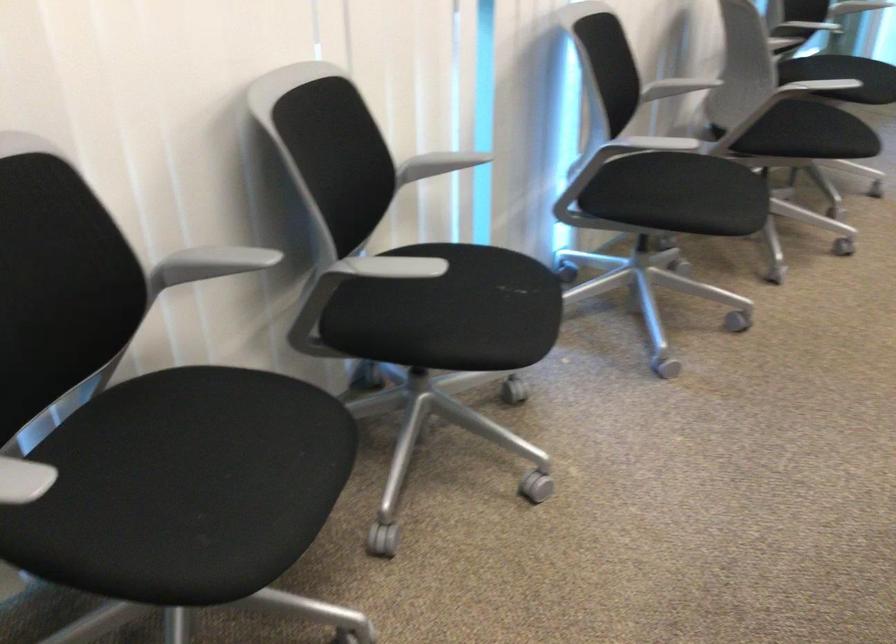
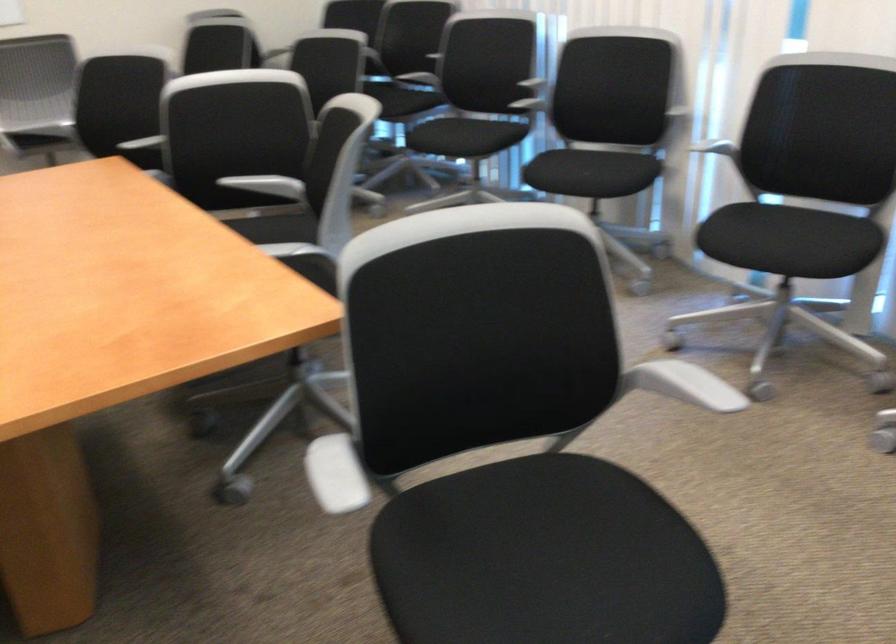
Locate, in the second image, the point that corresponds to the point at 509,283 in the first image.

(587, 174)